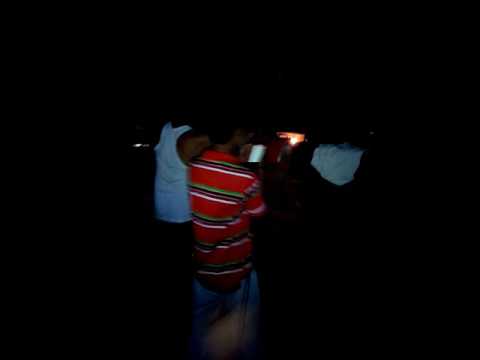
Image resolution: width=480 pixels, height=360 pixels. I want to click on towel, so click(224, 332).